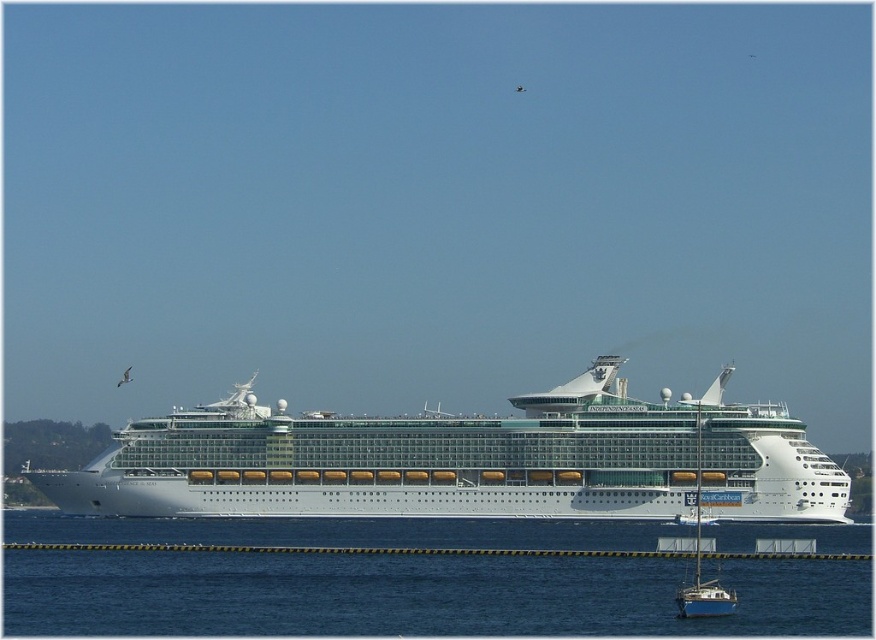
You are standing on the deck of the white glossy cruise ship at center and want to look at the blue water at lower center. In which direction should you turn your head?

The blue water at lower center is positioned on the left side of the white glossy cruise ship at center, so you should turn your head to the left to look at the blue water at lower center.

You are standing on the deck of the white glossy cruise ship at center. Looking down, you notice the blue water at lower center. Which one has a greater height from your current position?

The white glossy cruise ship at center has a greater height compared to the blue water at lower center because the blue water at lower center has a lesser height.

You are standing on the deck of the Independence of the Seas cruise ship and want to reach the point marked at coordinates point (605, 632). If you walk straight towards it, will you fall into the water?

The distance between you and the point (605, 632) is 66.02 meters. Since the point is on the ship, you won not fall into the water if you walk towards it.